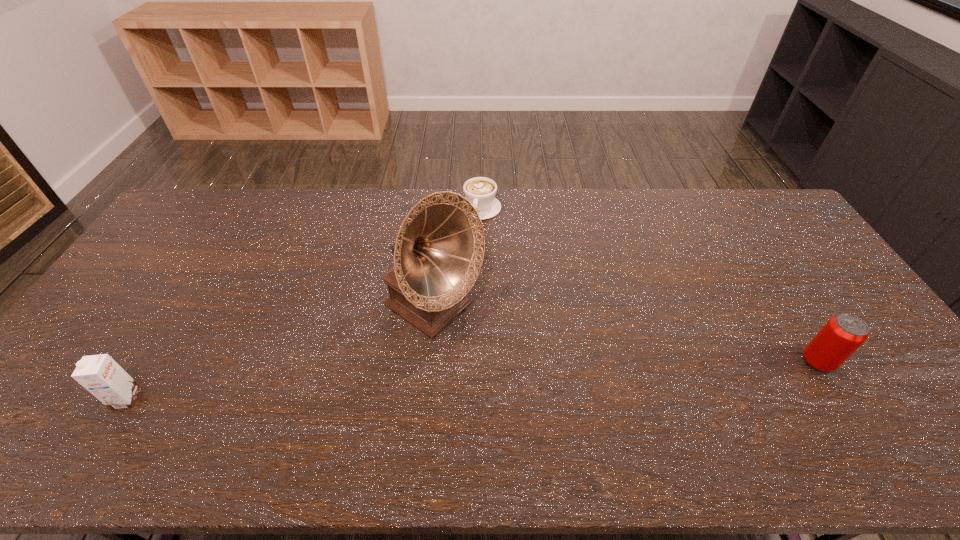
At what (x,y) coordinates should I click in order to perform the action: click on vacant space in between the rightmost object and the phonograph record. Please return your answer as a coordinate pair (x, y). Looking at the image, I should click on point(625,336).

Identify which object is located as the third nearest to the chocolate milk. Please provide its 2D coordinates. Your answer should be formatted as a tuple, i.e. [(x, y)], where the tuple contains the x and y coordinates of a point satisfying the conditions above.

[(843, 334)]

Locate which object is the second closest to the can. Please provide its 2D coordinates. Your answer should be formatted as a tuple, i.e. [(x, y)], where the tuple contains the x and y coordinates of a point satisfying the conditions above.

[(480, 191)]

Where is `vacant space that satisfies the following two spatial constraints: 1. on the back side of the tallest object; 2. on the left side of the cappuccino`? This screenshot has width=960, height=540. vacant space that satisfies the following two spatial constraints: 1. on the back side of the tallest object; 2. on the left side of the cappuccino is located at coordinates (444, 208).

Where is `free space that satisfies the following two spatial constraints: 1. on the back side of the can; 2. on the left side of the chocolate milk`? free space that satisfies the following two spatial constraints: 1. on the back side of the can; 2. on the left side of the chocolate milk is located at coordinates (150, 362).

Where is `vacant space that satisfies the following two spatial constraints: 1. on the back side of the rightmost object; 2. on the left side of the leftmost object`? vacant space that satisfies the following two spatial constraints: 1. on the back side of the rightmost object; 2. on the left side of the leftmost object is located at coordinates (150, 362).

Where is `free location that satisfies the following two spatial constraints: 1. on the back side of the tallest object; 2. on the right side of the chocolate milk`? This screenshot has width=960, height=540. free location that satisfies the following two spatial constraints: 1. on the back side of the tallest object; 2. on the right side of the chocolate milk is located at coordinates (180, 311).

The image size is (960, 540). Find the location of `vacant region that satisfies the following two spatial constraints: 1. on the front side of the cappuccino; 2. on the right side of the rightmost object`. vacant region that satisfies the following two spatial constraints: 1. on the front side of the cappuccino; 2. on the right side of the rightmost object is located at coordinates (480, 362).